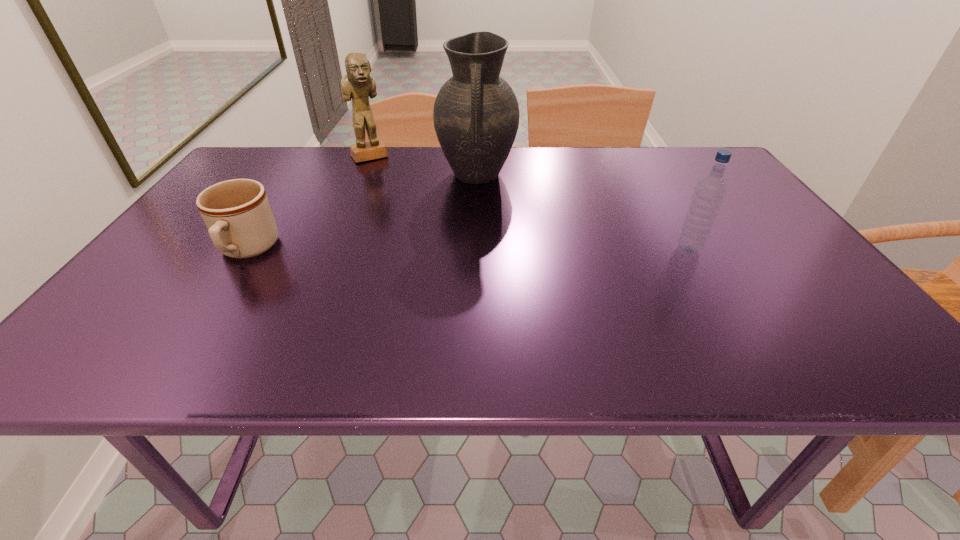
The height and width of the screenshot is (540, 960). Identify the location of free space at the near edge of the desktop. (622, 323).

The height and width of the screenshot is (540, 960). In the image, there is a desktop. In order to click on vacant space at the right edge in this screenshot , I will do `click(783, 239)`.

This screenshot has width=960, height=540. Identify the location of vacant space at the far left corner. (259, 151).

I want to click on vacant space at the near right corner, so click(802, 303).

At what (x,y) coordinates should I click in order to perform the action: click on blank region between the second object from right to left and the rightmost object. Please return your answer as a coordinate pair (x, y). This screenshot has width=960, height=540. Looking at the image, I should click on (583, 213).

Where is `empty location between the tallest object and the leftmost object`? This screenshot has width=960, height=540. empty location between the tallest object and the leftmost object is located at coordinates (362, 213).

Locate an element on the screen. free spot between the leftmost object and the second object from left to right is located at coordinates [308, 203].

Locate an element on the screen. The width and height of the screenshot is (960, 540). vacant area between the third object from left to right and the shortest object is located at coordinates (362, 213).

This screenshot has height=540, width=960. I want to click on vacant point located between the pitcher and the shortest object, so click(x=362, y=213).

Where is `free space between the second shortest object and the mug`? Image resolution: width=960 pixels, height=540 pixels. free space between the second shortest object and the mug is located at coordinates (468, 250).